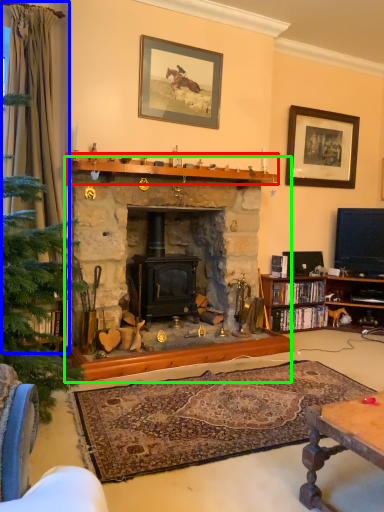
Question: Which object is positioned closest to mantle (highlighted by a red box)? Select from curtain (highlighted by a blue box) and fireplace (highlighted by a green box).

Choices:
 (A) curtain
 (B) fireplace

Answer: (B)